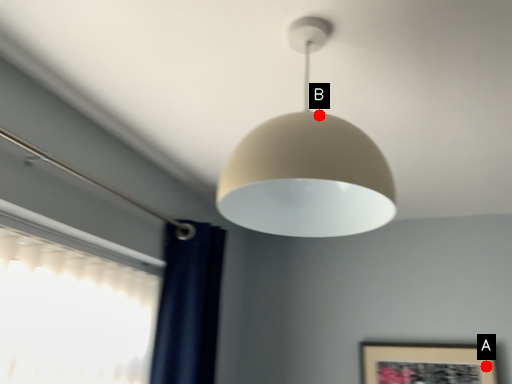
Question: Two points are circled on the image, labeled by A and B beside each circle. Which point is closer to the camera?

Choices:
 (A) A is closer
 (B) B is closer

Answer: (B)